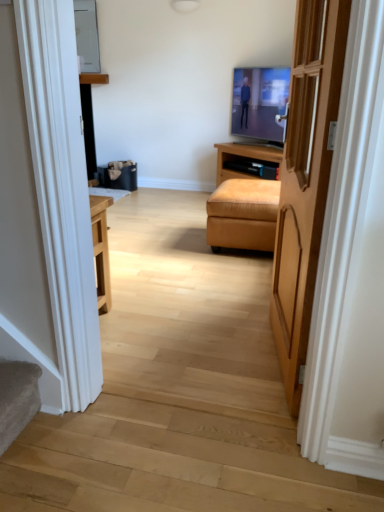
Locate an element on the screen. This screenshot has width=384, height=512. free space between suede-like tan ottoman at center and light brown wooden door at center is located at coordinates (244, 289).